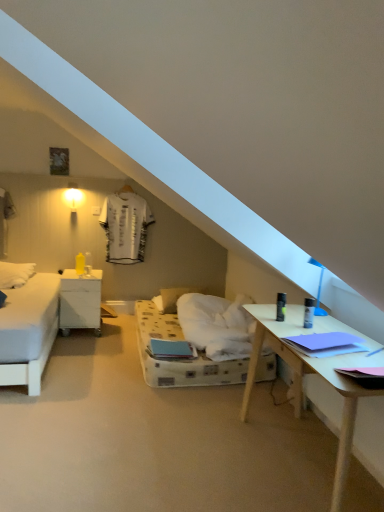
Question: Is white matte nightstand at left closer to camera compared to white soft pillow at center?

Choices:
 (A) yes
 (B) no

Answer: (A)

Question: Considering the relative sizes of white matte nightstand at left and white soft pillow at center in the image provided, is white matte nightstand at left smaller than white soft pillow at center?

Choices:
 (A) no
 (B) yes

Answer: (A)

Question: From the image's perspective, does white matte nightstand at left appear lower than white soft pillow at center?

Choices:
 (A) no
 (B) yes

Answer: (A)

Question: Can you confirm if white matte nightstand at left is taller than white soft pillow at center?

Choices:
 (A) no
 (B) yes

Answer: (B)

Question: Considering the relative sizes of white matte nightstand at left and white soft pillow at center in the image provided, is white matte nightstand at left bigger than white soft pillow at center?

Choices:
 (A) yes
 (B) no

Answer: (A)

Question: Considering the relative positions of white matte nightstand at left and white soft pillow at center in the image provided, is white matte nightstand at left to the left of white soft pillow at center from the viewer's perspective?

Choices:
 (A) yes
 (B) no

Answer: (A)

Question: From a real-world perspective, is white soft pillow at center below white matte nightstand at left?

Choices:
 (A) no
 (B) yes

Answer: (B)

Question: Is the surface of white soft pillow at center in direct contact with white matte nightstand at left?

Choices:
 (A) yes
 (B) no

Answer: (B)

Question: Is white soft pillow at center to the right of white matte nightstand at left from the viewer's perspective?

Choices:
 (A) yes
 (B) no

Answer: (A)

Question: Is white matte nightstand at left located within white soft pillow at center?

Choices:
 (A) yes
 (B) no

Answer: (B)

Question: Is white soft pillow at center outside of white matte nightstand at left?

Choices:
 (A) no
 (B) yes

Answer: (B)

Question: Considering the relative sizes of white soft pillow at center and white matte nightstand at left in the image provided, is white soft pillow at center smaller than white matte nightstand at left?

Choices:
 (A) no
 (B) yes

Answer: (B)

Question: Looking at their shapes, would you say white matte nightstand at left is wider or thinner than white soft pillow at center?

Choices:
 (A) wide
 (B) thin

Answer: (A)